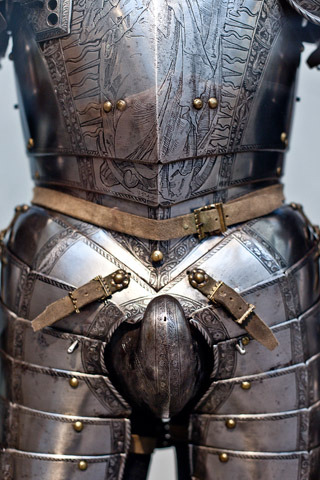
The width and height of the screenshot is (320, 480). In order to click on front of suit of armor from upper thighs to chest in this screenshot , I will do `click(281, 393)`.